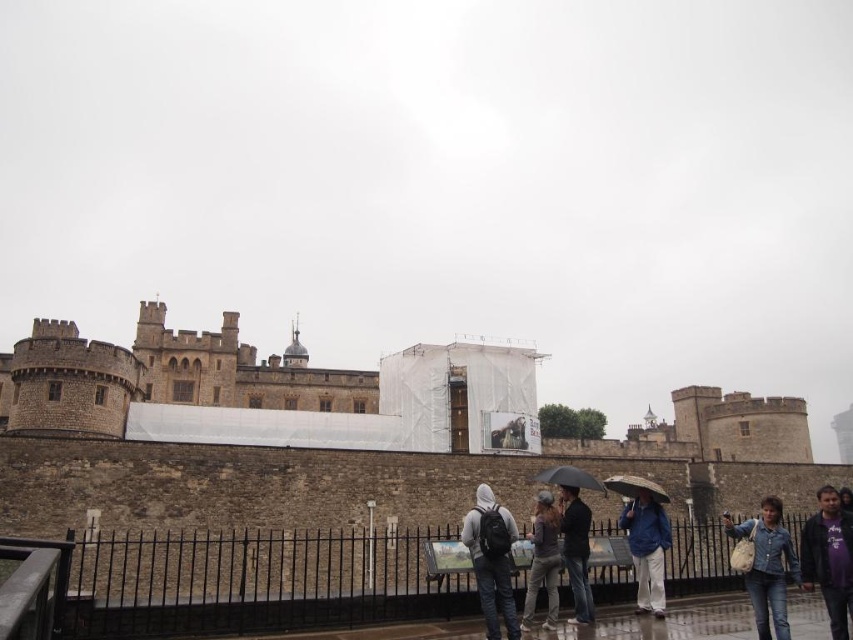
In the scene shown: Is dark gray hoodie at center shorter than blue fabric umbrella at lower right?

Indeed, dark gray hoodie at center has a lesser height compared to blue fabric umbrella at lower right.

Is point (486, 595) less distant than point (666, 547)?

Yes, point (486, 595) is in front of point (666, 547).

Find the location of `dark gray hoodie at center`. dark gray hoodie at center is located at coordinates (492, 561).

Can you confirm if dark blue jacket at lower right is taller than dark brown leather jacket at center?

Correct, dark blue jacket at lower right is much taller as dark brown leather jacket at center.

Is dark blue jacket at lower right positioned at the back of dark brown leather jacket at center?

No.

Find the location of a particular element. dark blue jacket at lower right is located at coordinates (828, 557).

At what (x,y) coordinates should I click in order to perform the action: click on dark blue jacket at lower right. Please return your answer as a coordinate pair (x, y). This screenshot has height=640, width=853. Looking at the image, I should click on (828, 557).

Which is behind, point (643, 488) or point (613, 484)?

The point (613, 484) is more distant.

Is the position of blue fabric umbrella at lower right less distant than that of transparent plastic umbrella at lower center?

That is True.

Is point (631, 508) positioned after point (645, 490)?

That is True.

The width and height of the screenshot is (853, 640). What are the coordinates of `blue fabric umbrella at lower right` in the screenshot? It's located at (647, 548).